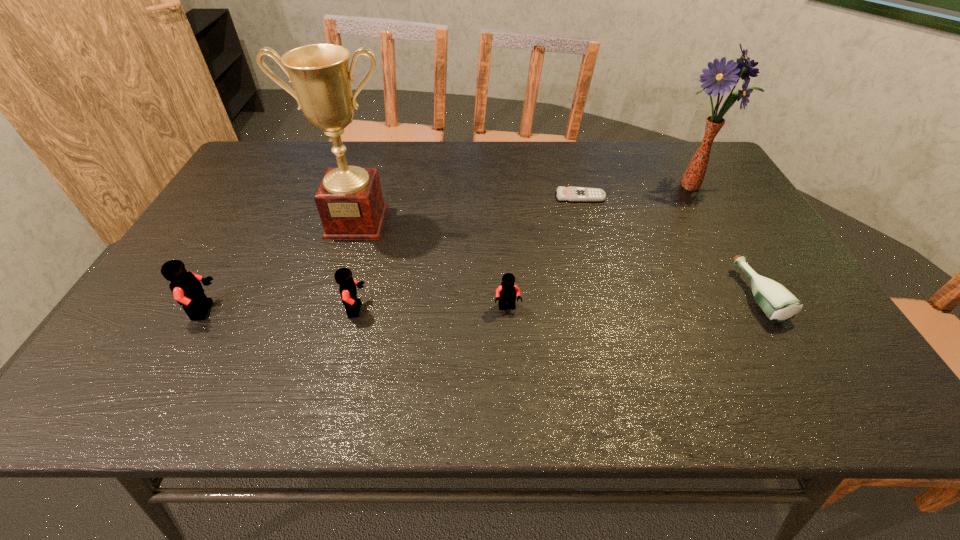
Find the location of `the leftmost Lego`. the leftmost Lego is located at coordinates (186, 287).

Find the location of a particular element. This screenshot has width=960, height=540. the fifth shortest object is located at coordinates (186, 287).

You are a GUI agent. You are given a task and a screenshot of the screen. Output one action in this format:
    pyautogui.click(x=<x>, y=<y>)
    Task: Click on the second tallest Lego
    The image size is (960, 540).
    Given the screenshot: What is the action you would take?
    pyautogui.click(x=343, y=276)

Where is `the second Lego from right to left`? The image size is (960, 540). the second Lego from right to left is located at coordinates (343, 276).

Find the location of `the fourth object from right to left`. the fourth object from right to left is located at coordinates (506, 293).

The width and height of the screenshot is (960, 540). Find the location of `the shortest Lego`. the shortest Lego is located at coordinates (506, 293).

Where is `remote control`? The width and height of the screenshot is (960, 540). remote control is located at coordinates (571, 194).

I want to click on the shortest object, so click(571, 194).

At what (x,y) coordinates should I click in order to perform the action: click on flower arrangement. Please return your answer as a coordinate pair (x, y). The image size is (960, 540). Looking at the image, I should click on (717, 79).

Locate an element on the screen. the fifth nearest object is located at coordinates (349, 200).